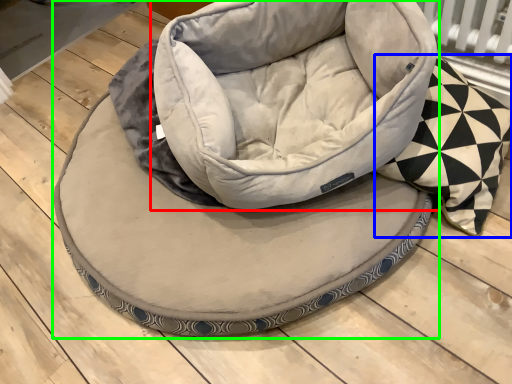
Question: Estimate the real-world distances between objects in this image. Which object is closer to bean bag chair (highlighted by a red box), throw pillow (highlighted by a blue box) or dog bed (highlighted by a green box)?

Choices:
 (A) throw pillow
 (B) dog bed

Answer: (B)